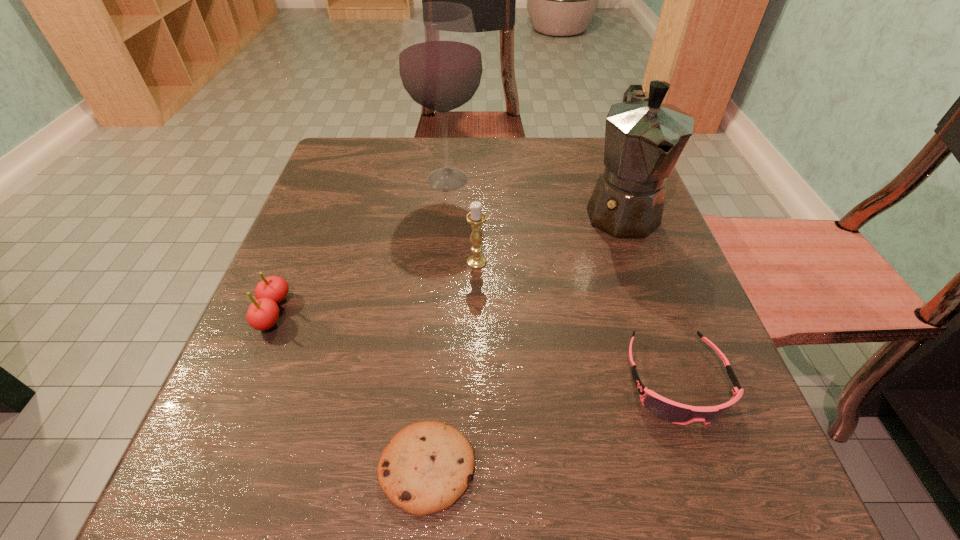
Where is `object that is at the far right corner`? The width and height of the screenshot is (960, 540). object that is at the far right corner is located at coordinates (644, 138).

In the image, there is a desktop. Where is `free space at the far edge`? free space at the far edge is located at coordinates (534, 153).

At what (x,y) coordinates should I click in order to perform the action: click on vacant space at the near edge. Please return your answer as a coordinate pair (x, y). The height and width of the screenshot is (540, 960). Looking at the image, I should click on (361, 484).

Image resolution: width=960 pixels, height=540 pixels. Find the location of `free region at the left edge of the desktop`. free region at the left edge of the desktop is located at coordinates (348, 280).

Locate an element on the screen. The height and width of the screenshot is (540, 960). free location at the right edge of the desktop is located at coordinates (626, 244).

This screenshot has width=960, height=540. In the image, there is a desktop. Find the location of `free space at the far left corner`. free space at the far left corner is located at coordinates (370, 186).

Locate an element on the screen. Image resolution: width=960 pixels, height=540 pixels. free location at the near left corner of the desktop is located at coordinates (307, 483).

In the image, there is a desktop. At what (x,y) coordinates should I click in order to perform the action: click on free space at the far right corner. Please return your answer as a coordinate pair (x, y). This screenshot has height=540, width=960. Looking at the image, I should click on (572, 151).

Locate an element on the screen. This screenshot has height=540, width=960. free spot between the goggles and the leftmost object is located at coordinates (474, 347).

This screenshot has width=960, height=540. In order to click on vacant space that's between the shortest object and the goggles in this screenshot , I will do `click(552, 424)`.